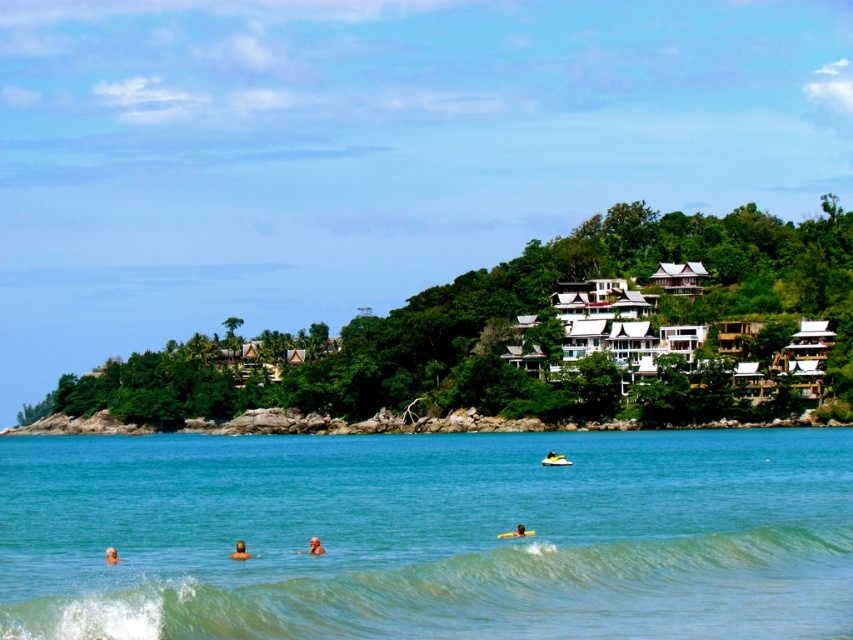
Describe the element at coordinates (428, 536) in the screenshot. This screenshot has width=853, height=640. I see `clear blue water at center` at that location.

Between clear blue water at center and yellow foam surfboard at lower center, which one is positioned lower?

clear blue water at center is lower down.

Image resolution: width=853 pixels, height=640 pixels. What are the coordinates of `clear blue water at center` in the screenshot? It's located at (428, 536).

In order to click on clear blue water at center in this screenshot , I will do `click(428, 536)`.

Which of these two, green leafy hill at upper center or yellow foam surfboard at lower center, stands shorter?

yellow foam surfboard at lower center

Find the location of `green leafy hill at upper center`. green leafy hill at upper center is located at coordinates (492, 317).

You are a GUI agent. You are given a task and a screenshot of the screen. Output one action in this format:
    pyautogui.click(x=<x>, y=<y>)
    Task: Click on the green leafy hill at upper center
    The image size is (853, 640).
    Given the screenshot: What is the action you would take?
    pyautogui.click(x=492, y=317)

This screenshot has height=640, width=853. I want to click on green leafy hill at upper center, so click(x=492, y=317).

Which is below, green leafy hill at upper center or brown skin at center?

brown skin at center is below.

Does point (434, 362) come in front of point (241, 552)?

No, (434, 362) is behind (241, 552).

The image size is (853, 640). Find the location of `green leafy hill at upper center`. green leafy hill at upper center is located at coordinates (492, 317).